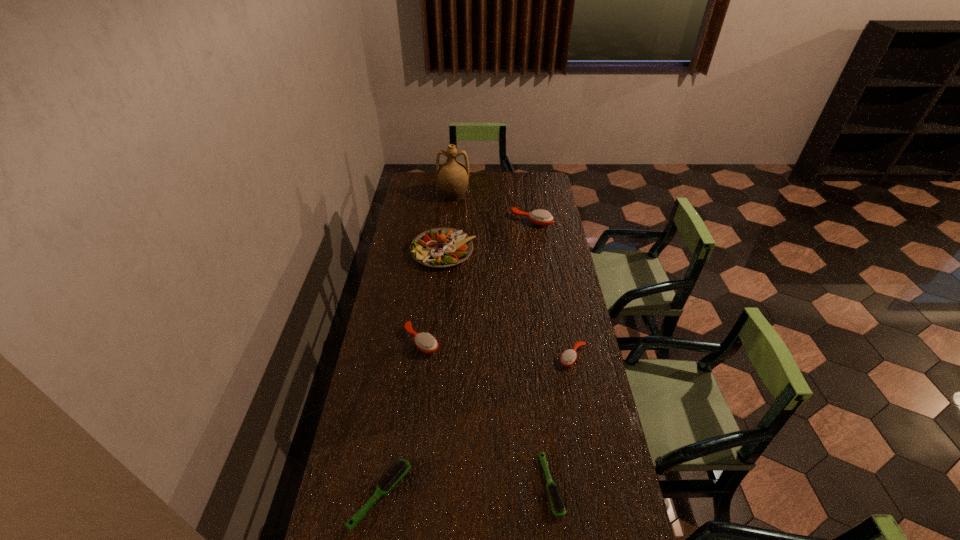
You are a GUI agent. You are given a task and a screenshot of the screen. Output one action in this format:
    pyautogui.click(x=<x>, y=<y>)
    Task: Click on the tallest object
    
    Given the screenshot: What is the action you would take?
    pyautogui.click(x=453, y=176)

Identify the location of the farthest object. This screenshot has height=540, width=960. (453, 176).

Locate an element on the screen. The height and width of the screenshot is (540, 960). the fifth nearest object is located at coordinates (441, 247).

Where is `salad plate`? This screenshot has height=540, width=960. salad plate is located at coordinates (441, 247).

At what (x,y) coordinates should I click in order to perform the action: click on the second farthest object. Please return your answer as a coordinate pair (x, y). This screenshot has width=960, height=540. Looking at the image, I should click on (539, 217).

Locate an element on the screen. The height and width of the screenshot is (540, 960). the biggest orange hairbrush is located at coordinates (539, 217).

Image resolution: width=960 pixels, height=540 pixels. In order to click on the leftmost orange hairbrush in this screenshot , I will do `click(425, 342)`.

What are the coordinates of `the second smallest orange hairbrush` in the screenshot? It's located at (425, 342).

Identify the location of the bigger light hairbrush. Image resolution: width=960 pixels, height=540 pixels. (400, 468).

I want to click on the smallest orange hairbrush, so click(x=568, y=357).